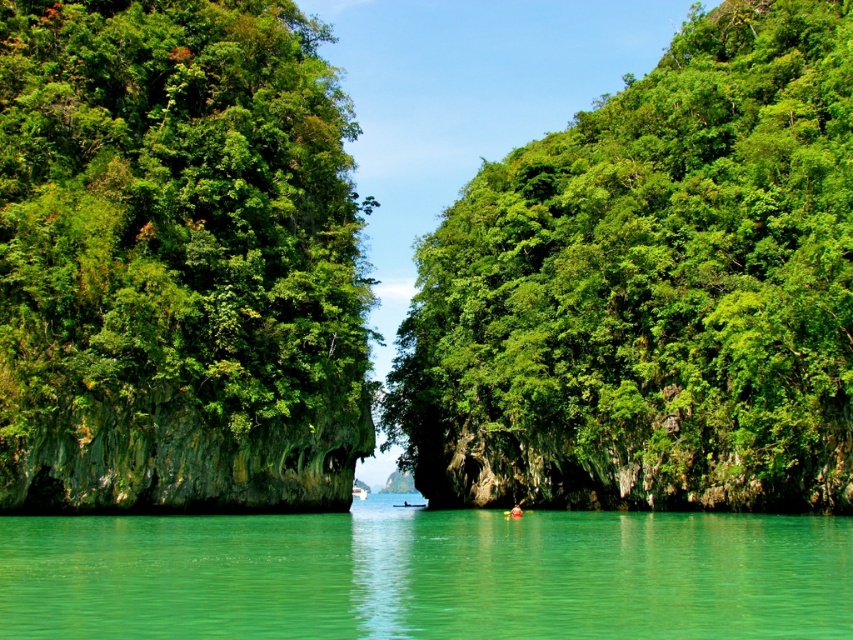
Which is below, green leafy tree at center or clear water at center?

clear water at center is lower down.

Is green leafy tree at center positioned before clear water at center?

No.

At what (x,y) coordinates should I click in order to perform the action: click on green leafy tree at center. Please return your answer as a coordinate pair (x, y). Image resolution: width=853 pixels, height=640 pixels. Looking at the image, I should click on (653, 291).

Is green leafy tree at center below green leafy tree at left?

Correct, green leafy tree at center is located below green leafy tree at left.

Measure the distance from green leafy tree at center to green leafy tree at left.

A distance of 34.96 meters exists between green leafy tree at center and green leafy tree at left.

Between point (436, 497) and point (286, 28), which one is positioned behind?

Point (436, 497)

The height and width of the screenshot is (640, 853). I want to click on green leafy tree at center, so click(653, 291).

Who is more distant from viewer, (61, 397) or (436, 552)?

The point (61, 397) is behind.

Between point (314, 208) and point (126, 540), which one is positioned behind?

Positioned behind is point (314, 208).

Where is `green leafy tree at left`? Image resolution: width=853 pixels, height=640 pixels. green leafy tree at left is located at coordinates (173, 211).